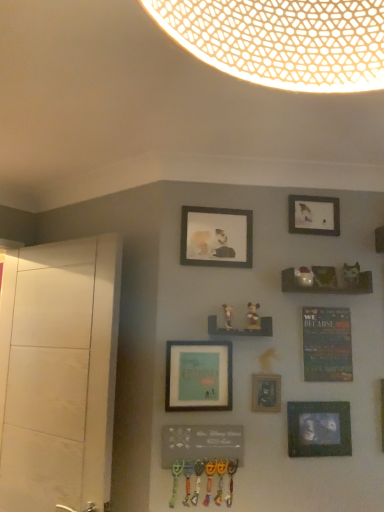
Question: Looking at their shapes, would you say matte white figurine at center-right, the first art positioned from the right, is wider or thinner than matte black picture frame at lower right, which is the first picture frame from bottom to top?

Choices:
 (A) thin
 (B) wide

Answer: (B)

Question: Is matte white figurine at center-right, arranged as the third art when viewed from the left, in front of or behind matte black picture frame at lower right, the 5th picture frame when ordered from top to bottom, in the image?

Choices:
 (A) front
 (B) behind

Answer: (B)

Question: Which object is positioned farthest from the wooden shelf at center-right, the first shelf in the right-to-left sequence?

Choices:
 (A) matte black picture frame at lower right, the 5th picture frame when ordered from top to bottom
 (B) wooden shelf at center, positioned as the second shelf in right-to-left order
 (C) matte black picture frame at center, arranged as the second picture frame when ordered from the bottom
 (D) matte brown figurine at center-right, which is the second art from right to left
 (E) matte white figurine at center-right, arranged as the third art when viewed from the left

Answer: (A)

Question: Which of these objects is positioned closest to the wooden shelf at center-right, which is the second shelf in bottom-to-top order?

Choices:
 (A) matte white figurine at center-right, arranged as the third art when viewed from the left
 (B) matte wooden picture frame at upper center, the 2th picture frame in the top-to-bottom sequence
 (C) matte brown figurine at center-right, arranged as the second art when viewed from the left
 (D) wooden mickey mouse figurine at center, the first art from the left
 (E) white matte dresser at left

Answer: (A)